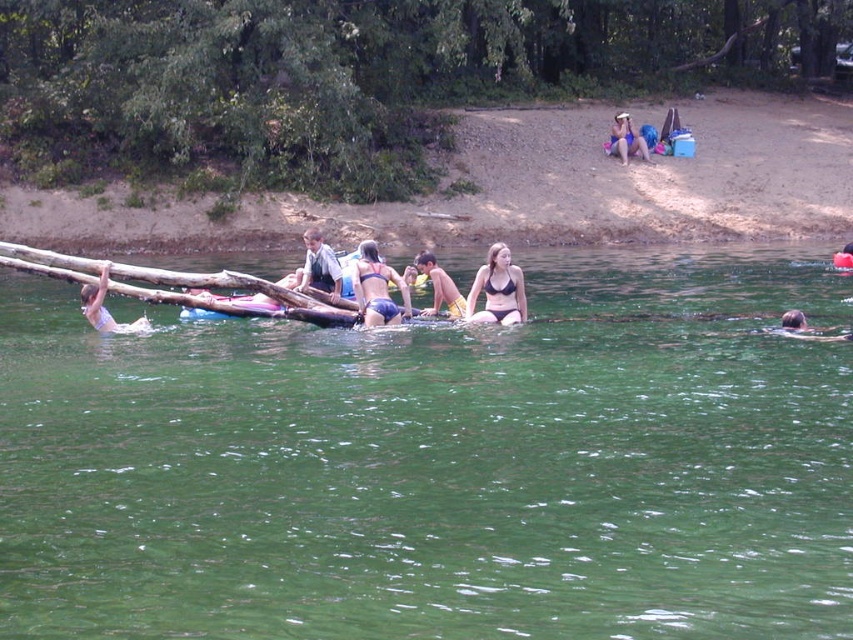
Which is in front, point (495, 285) or point (631, 129)?

Positioned in front is point (495, 285).

Who is more forward, (503, 323) or (627, 118)?

Point (503, 323)

You are a GUI agent. You are given a task and a screenshot of the screen. Output one action in this format:
    pyautogui.click(x=<x>, y=<y>)
    Task: Click on the black matte bikini at center
    The image size is (853, 640).
    Given the screenshot: What is the action you would take?
    pyautogui.click(x=497, y=289)

Is matte white swimsuit at left smaller than smooth brown hair at lower right?

Incorrect, matte white swimsuit at left is not smaller in size than smooth brown hair at lower right.

How much distance is there between matte white swimsuit at left and smooth brown hair at lower right?

27.49 feet

Identify the location of matte white swimsuit at left. (105, 307).

Who is more forward, (305, 244) or (799, 328)?

Point (799, 328) is more forward.

The image size is (853, 640). Describe the element at coordinates (318, 264) in the screenshot. I see `dark blue shirt at center` at that location.

The width and height of the screenshot is (853, 640). Find the location of `dark blue shirt at center`. dark blue shirt at center is located at coordinates (318, 264).